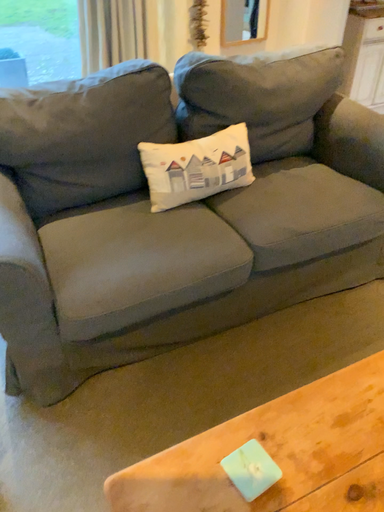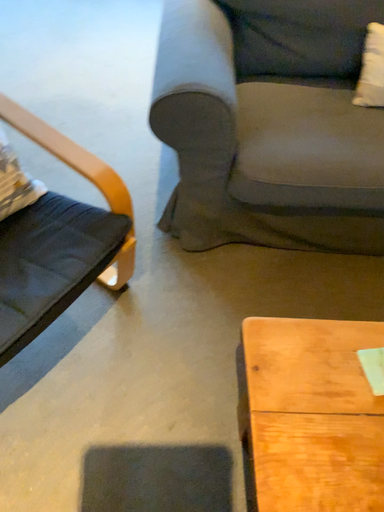
Question: How did the camera likely rotate when shooting the video?

Choices:
 (A) rotated left
 (B) rotated right

Answer: (A)